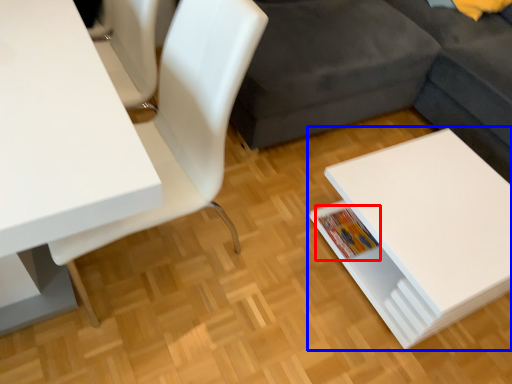
Question: Which object is closer to the camera taking this photo, book (highlighted by a red box) or table (highlighted by a blue box)?

Choices:
 (A) book
 (B) table

Answer: (B)